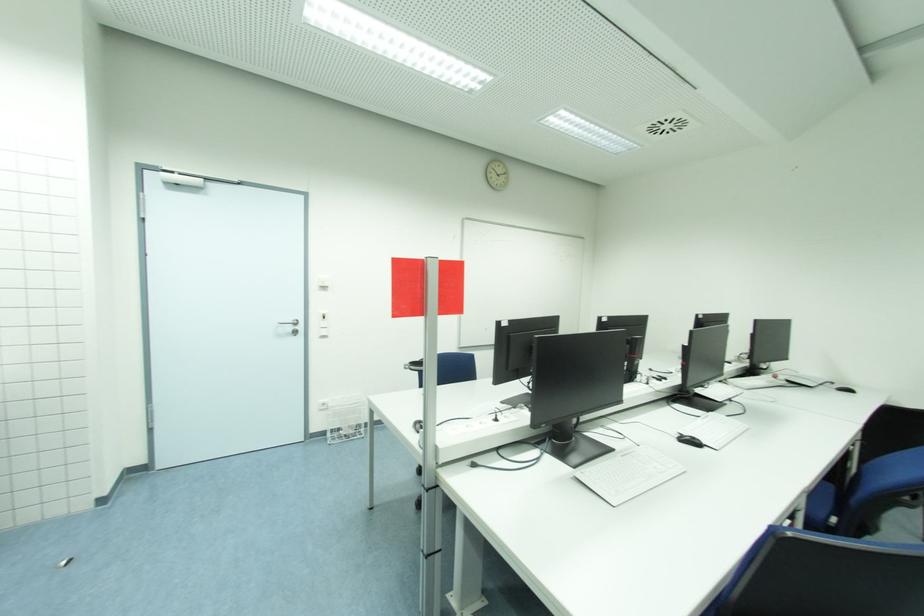
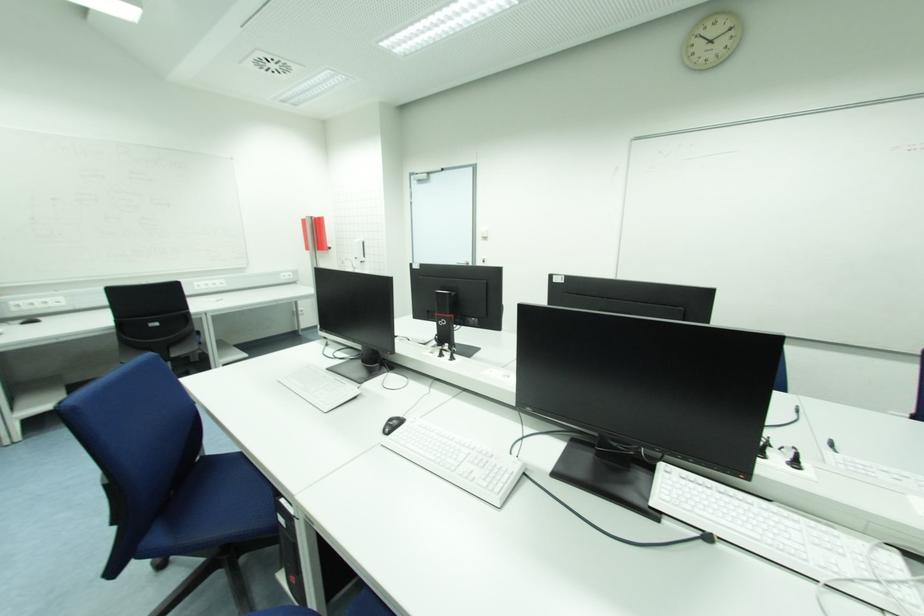
The point at [723,386] is marked in the first image. Where is the corresponding point in the second image?

(900, 560)